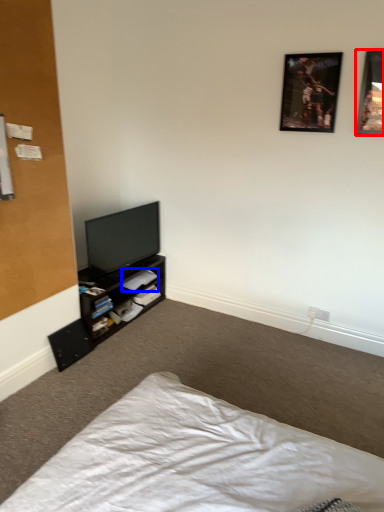
Question: Which point is closer to the camera, picture frame (highlighted by a red box) or book (highlighted by a blue box)?

Choices:
 (A) picture frame
 (B) book

Answer: (A)